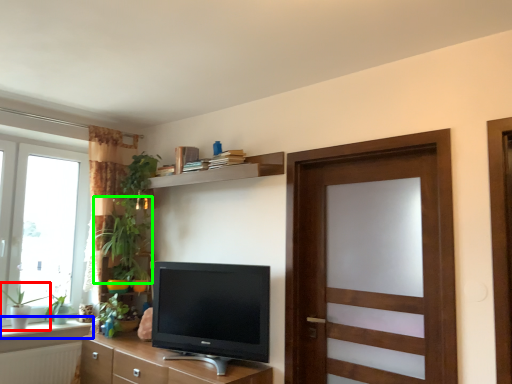
Question: Estimate the real-world distances between objects in this image. Which object is closer to plant (highlighted by a red box), window sill (highlighted by a blue box) or plant (highlighted by a green box)?

Choices:
 (A) window sill
 (B) plant

Answer: (A)